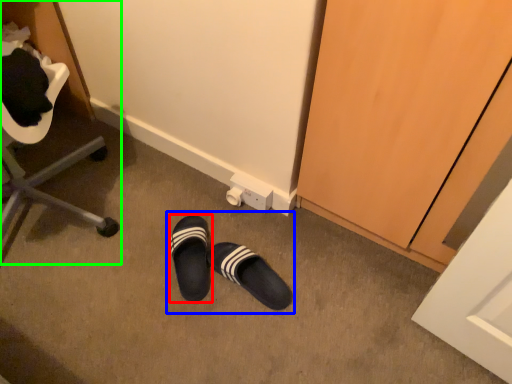
Question: Which is nearer to the footwear (highlighted by a red box)? leather shoe (highlighted by a blue box) or furniture (highlighted by a green box).

Choices:
 (A) leather shoe
 (B) furniture

Answer: (A)